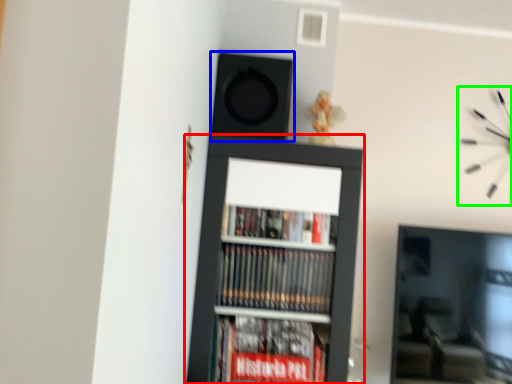
Question: Considering the real-world distances, which object is farthest from bookcase (highlighted by a red box)? speaker (highlighted by a blue box) or clock (highlighted by a green box)?

Choices:
 (A) speaker
 (B) clock

Answer: (B)